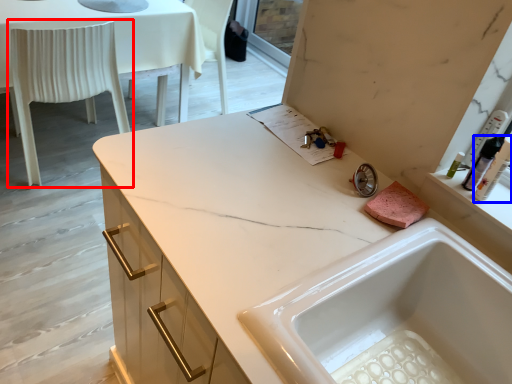
Question: Among these objects, which one is nearest to the camera, chair (highlighted by a red box) or toiletry (highlighted by a blue box)?

Choices:
 (A) chair
 (B) toiletry

Answer: (B)